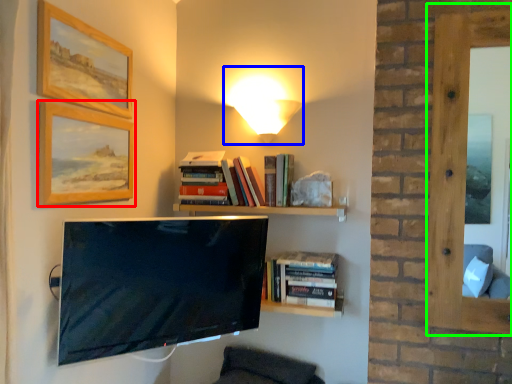
Question: Which object is the closest to the picture frame (highlighted by a red box)? Choose among these: table lamp (highlighted by a blue box) or window (highlighted by a green box).

Choices:
 (A) table lamp
 (B) window

Answer: (A)